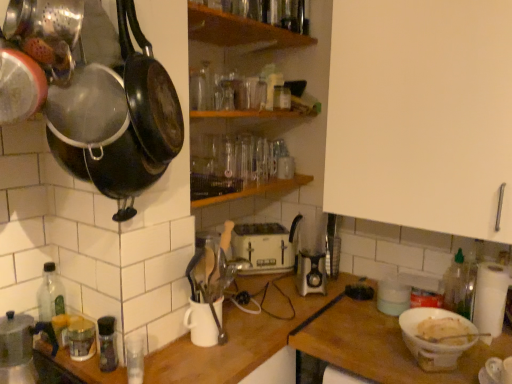
Locate an element on the screen. free region under black matte frying pan at upper left, which is the 1th frying pan from right to left (from a real-world perspective) is located at coordinates (159, 366).